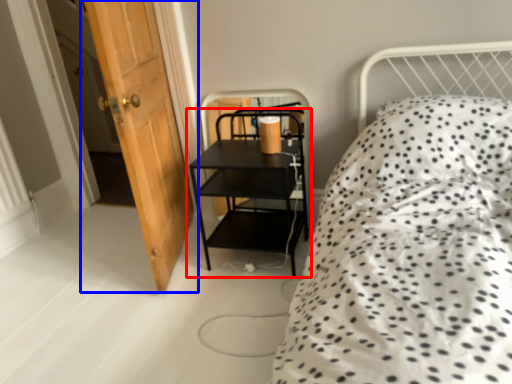
Question: Which object appears closest to the camera in this image, shelf (highlighted by a red box) or door (highlighted by a blue box)?

Choices:
 (A) shelf
 (B) door

Answer: (B)